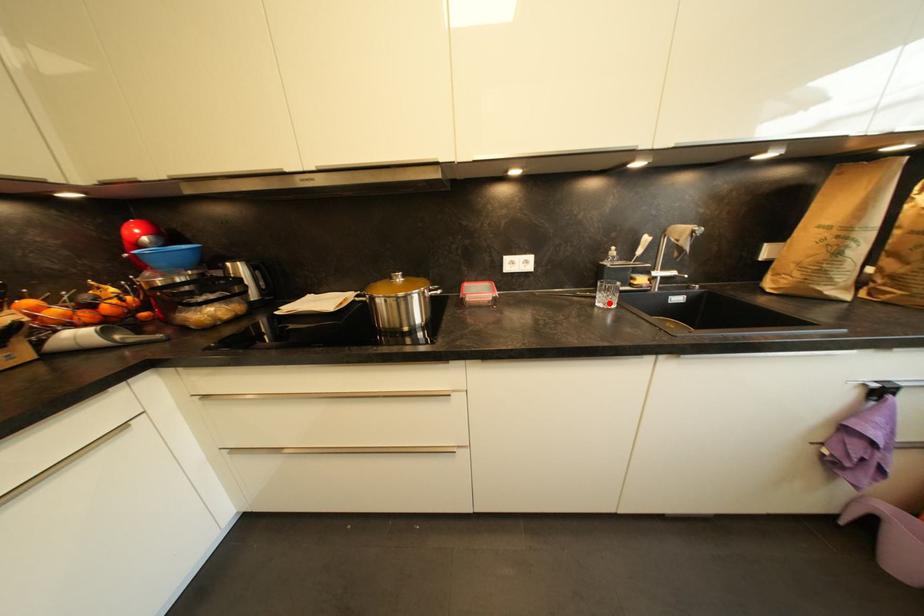
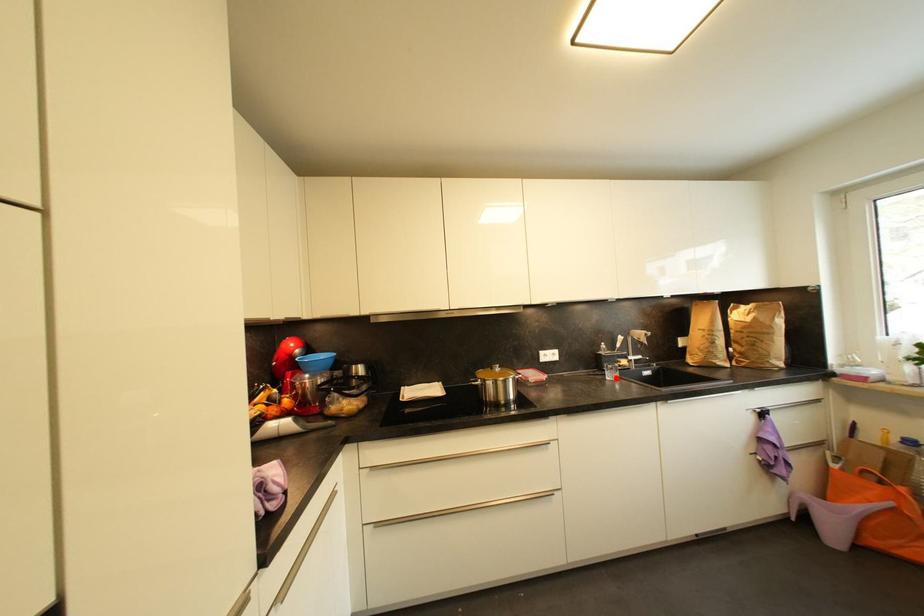
I am providing you with two images of the same scene from different viewpoints. A red point is marked on the first image and another point is marked on the second image. Do the highlighted points in image1 and image2 indicate the same real-world spot?

Yes